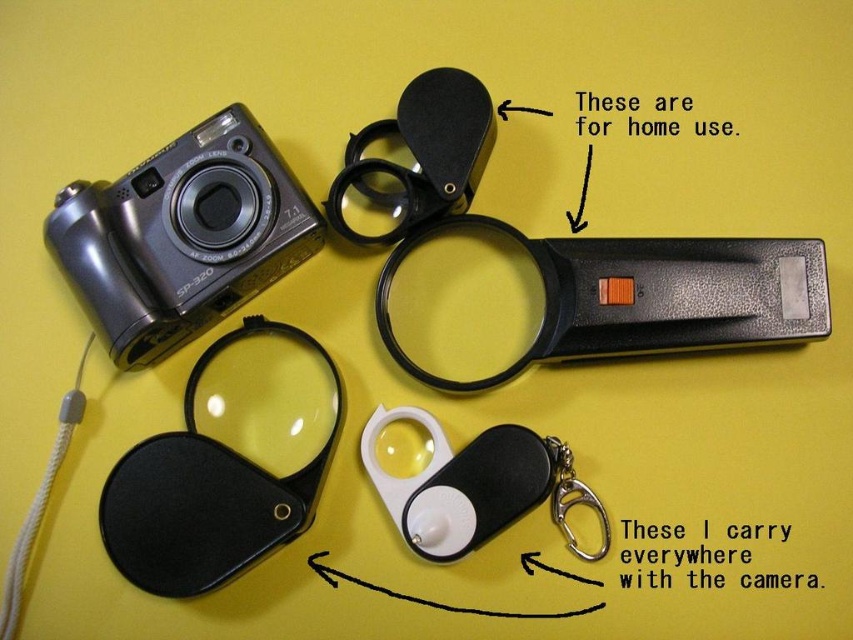
Question: Which point is farther to the camera?

Choices:
 (A) matte black camera at upper left
 (B) metallic silver keychain at lower center
 (C) black matte lens filter at lower left

Answer: (B)

Question: Among these points, which one is nearest to the camera?

Choices:
 (A) (107, 547)
 (B) (258, 208)
 (C) (552, 456)

Answer: (A)

Question: Is black matte lens filter at lower left wider than metallic silver keychain at lower center?

Choices:
 (A) yes
 (B) no

Answer: (A)

Question: Is matte black camera at upper left below metallic silver keychain at lower center?

Choices:
 (A) no
 (B) yes

Answer: (A)

Question: Which point is farther to the camera?

Choices:
 (A) metallic silver keychain at lower center
 (B) black matte lens filter at lower left

Answer: (A)

Question: Can you confirm if matte black camera at upper left is positioned above black matte lens filter at lower left?

Choices:
 (A) yes
 (B) no

Answer: (A)